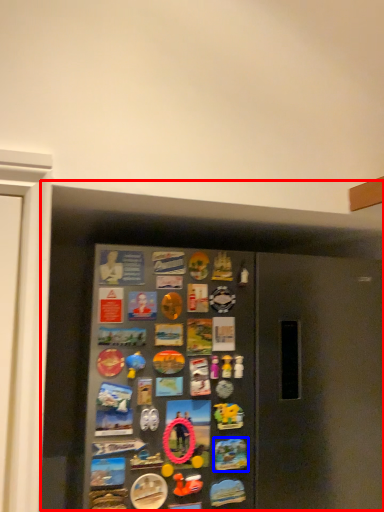
Question: Which object appears farthest to the camera in this image, fridge (highlighted by a red box) or button (highlighted by a blue box)?

Choices:
 (A) fridge
 (B) button

Answer: (B)